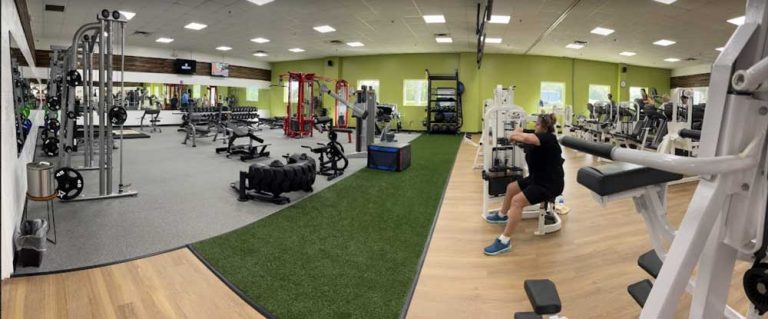
Where is `windows`? This screenshot has height=319, width=768. windows is located at coordinates tap(290, 92), tap(371, 82), tap(415, 89), tap(554, 87), tap(601, 96), tap(639, 92).